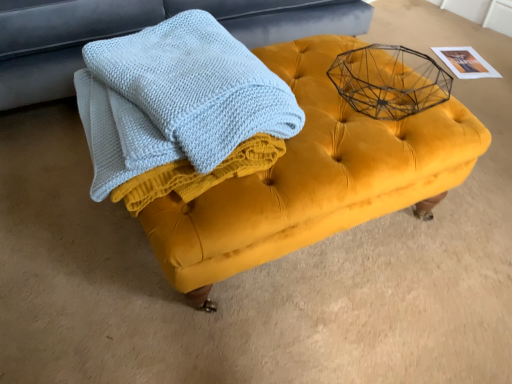
Question: Is velvet yellow ottoman at center bigger or smaller than light blue knitted towel at center?

Choices:
 (A) small
 (B) big

Answer: (B)

Question: From a real-world perspective, is velvet yellow ottoman at center above or below light blue knitted towel at center?

Choices:
 (A) above
 (B) below

Answer: (B)

Question: Estimate the real-world distances between objects in this image. Which object is closer to the velvet yellow ottoman at center?

Choices:
 (A) velvet yellow ottoman at center
 (B) light blue knitted towel at center

Answer: (B)

Question: Which of these objects is positioned farthest from the velvet yellow ottoman at center?

Choices:
 (A) light blue knitted towel at center
 (B) velvet yellow ottoman at center

Answer: (B)